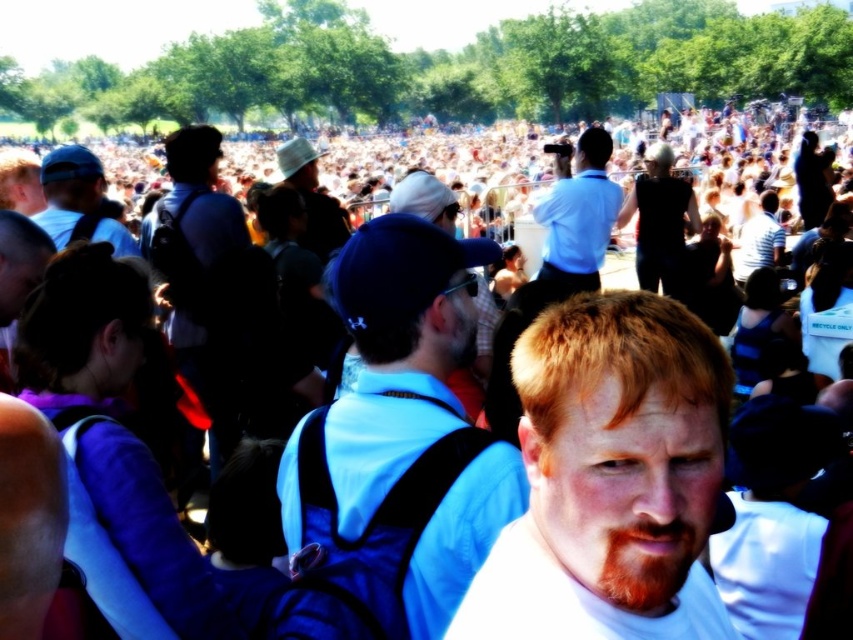
Question: Is light brown hair at center thinner than blue fabric backpack at center?

Choices:
 (A) no
 (B) yes

Answer: (B)

Question: Based on their relative distances, which object is farther from the dark blue backpack at center?

Choices:
 (A) white hat at center
 (B) matte blue cap at upper left
 (C) light brown hair at center

Answer: (C)

Question: Which point is closer to the camera?

Choices:
 (A) dark blue backpack at center
 (B) blue fabric backpack at center
 (C) matte blue cap at upper left

Answer: (B)

Question: Does light brown hair at center have a lesser width compared to striped shirt at center?

Choices:
 (A) no
 (B) yes

Answer: (A)

Question: In this image, where is dark blue backpack at center located relative to reddish-brown stubble at center?

Choices:
 (A) above
 (B) below

Answer: (A)

Question: Which point is farther from the camera taking this photo?

Choices:
 (A) (207, 216)
 (B) (727, 378)

Answer: (A)